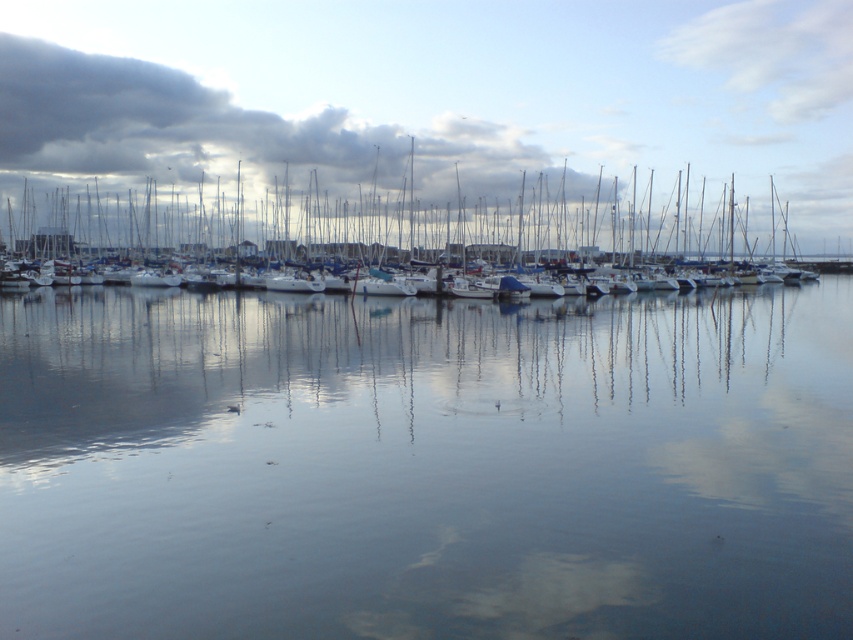
Question: Which is farther from the dark gray cloud at upper left?

Choices:
 (A) white matte boats at center
 (B) transparent water at center

Answer: (B)

Question: Which of these objects is positioned farthest from the white matte boats at center?

Choices:
 (A) transparent water at center
 (B) dark gray cloud at upper left

Answer: (A)

Question: Is white matte boats at center behind dark gray cloud at upper left?

Choices:
 (A) yes
 (B) no

Answer: (B)

Question: Does transparent water at center appear over dark gray cloud at upper left?

Choices:
 (A) no
 (B) yes

Answer: (A)

Question: Is transparent water at center thinner than dark gray cloud at upper left?

Choices:
 (A) no
 (B) yes

Answer: (B)

Question: Which of the following is the farthest from the observer?

Choices:
 (A) (158, 140)
 (B) (189, 182)
 (C) (479, 320)

Answer: (A)